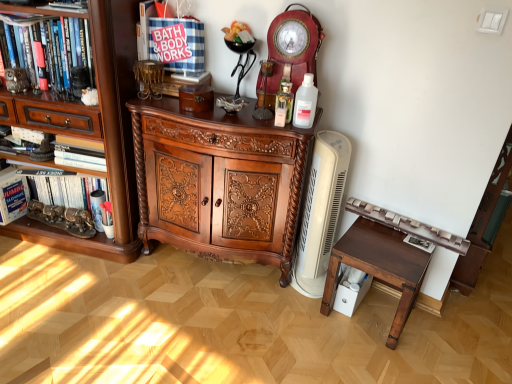
Identify the location of free space to the left of dark wood carved cabinet at center. The height and width of the screenshot is (384, 512). (95, 288).